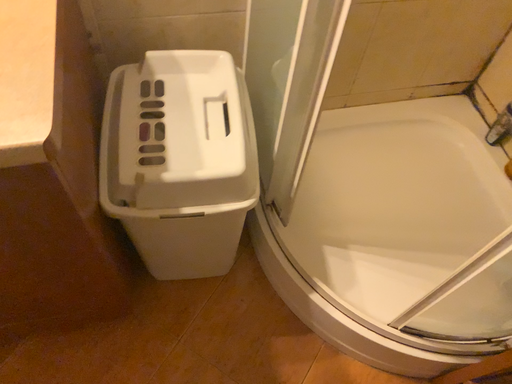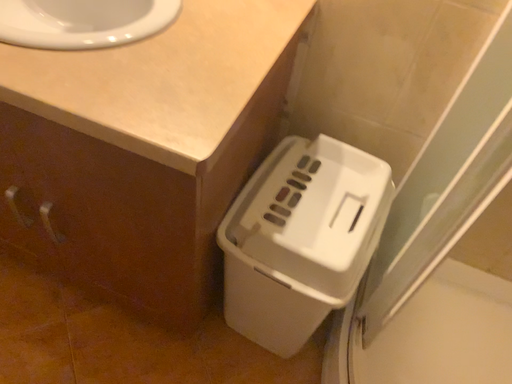
Question: Which way did the camera rotate in the video?

Choices:
 (A) rotated downward
 (B) rotated upward

Answer: (B)